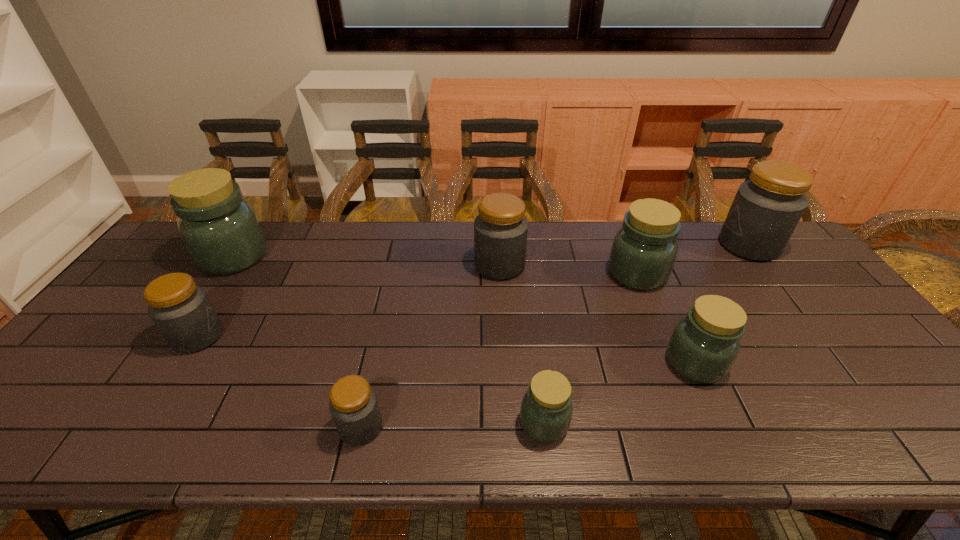
Locate an element on the screen. free region that satisfies the following two spatial constraints: 1. on the surface of the third smallest green jar near the warning symbol; 2. on the right side of the third gray jar from left to right is located at coordinates (500, 274).

Where is `vacant space that satisfies the following two spatial constraints: 1. on the surface of the leftmost gray jar near the warning symbol; 2. on the right side of the second green jar from left to right`? The image size is (960, 540). vacant space that satisfies the following two spatial constraints: 1. on the surface of the leftmost gray jar near the warning symbol; 2. on the right side of the second green jar from left to right is located at coordinates (143, 423).

Image resolution: width=960 pixels, height=540 pixels. In order to click on free space in the image that satisfies the following two spatial constraints: 1. on the surface of the third smallest green jar near the warning symbol; 2. on the left side of the third gray jar from left to right in this screenshot , I will do `click(500, 274)`.